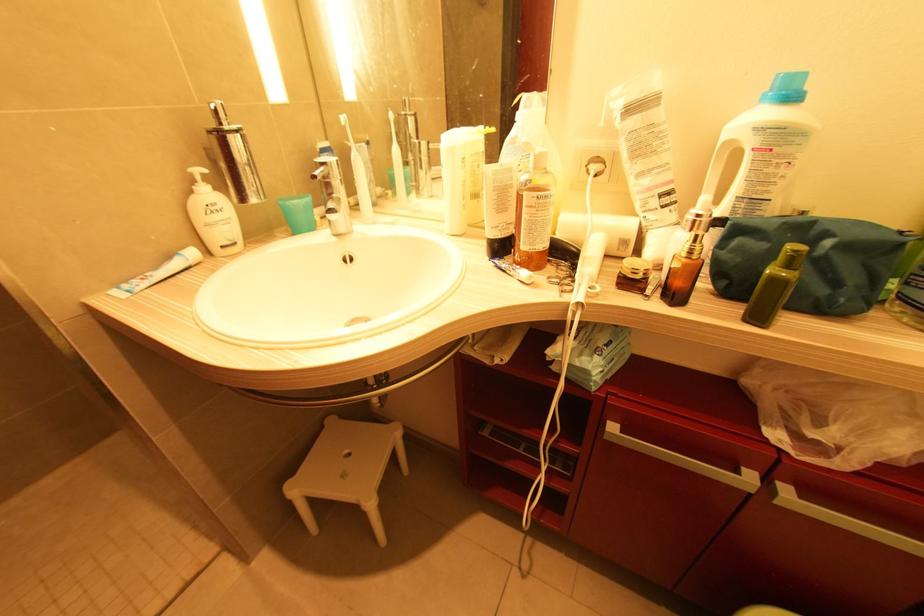
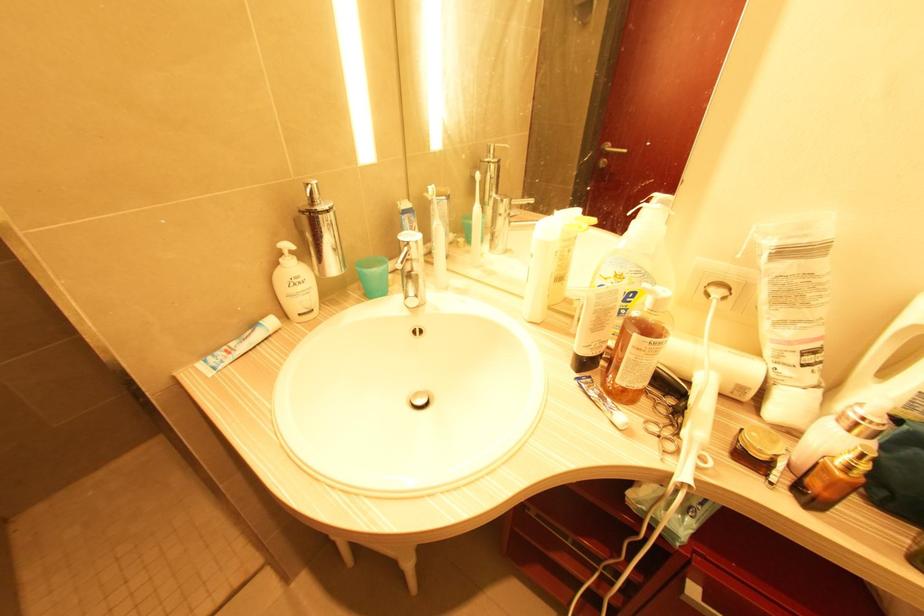
Where in the second image is the point corresponding to pixel 283 204 from the first image?

(359, 270)